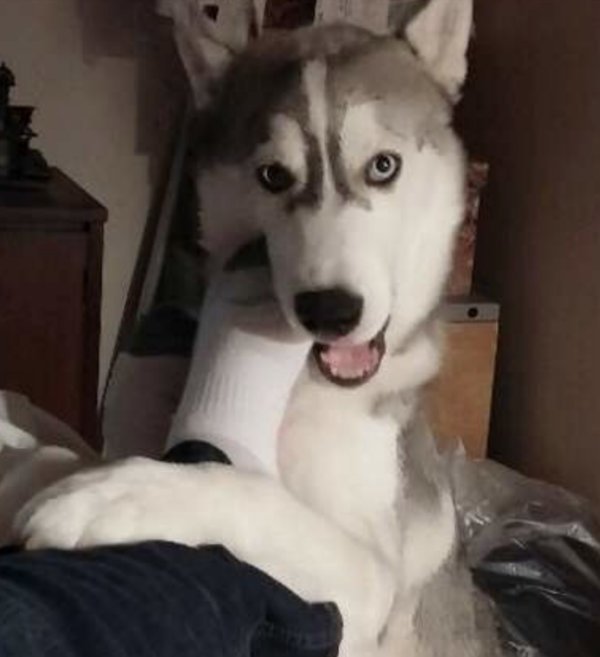
At what (x,y) coordinates should I click in order to perform the action: click on funiture. Please return your answer as a coordinate pair (x, y). Looking at the image, I should click on (55, 280).